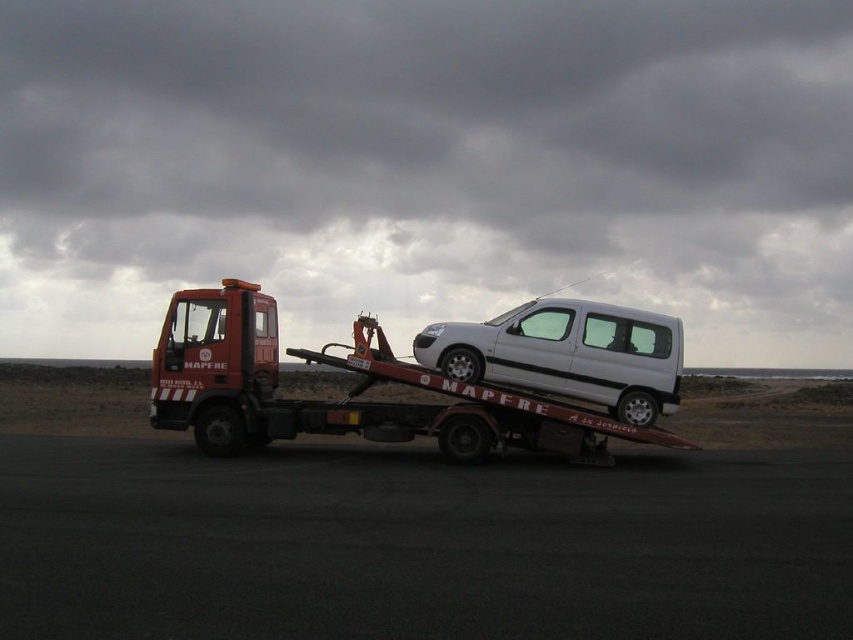
Question: Which object appears farthest from the camera in this image?

Choices:
 (A) white matte van at center
 (B) matte red tow truck at center

Answer: (A)

Question: Does matte red tow truck at center have a smaller size compared to white matte van at center?

Choices:
 (A) no
 (B) yes

Answer: (A)

Question: Can you confirm if matte red tow truck at center is positioned below white matte van at center?

Choices:
 (A) no
 (B) yes

Answer: (B)

Question: Which object is farther from the camera taking this photo?

Choices:
 (A) matte red tow truck at center
 (B) white matte van at center

Answer: (B)

Question: Can you confirm if matte red tow truck at center is thinner than white matte van at center?

Choices:
 (A) no
 (B) yes

Answer: (A)